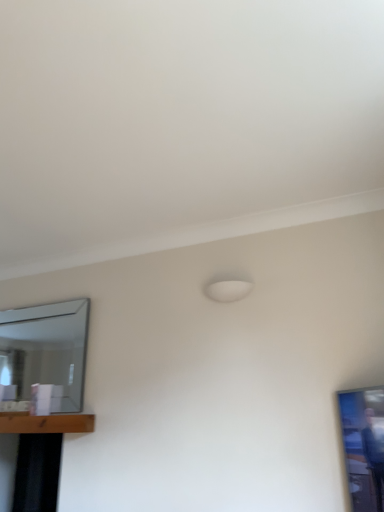
Question: Looking at the image, does brown wooden table at lower left, which appears as the first table when viewed from the top, seem bigger or smaller compared to clear glass mirror at left?

Choices:
 (A) big
 (B) small

Answer: (B)

Question: From the image's perspective, is brown wooden table at lower left, which appears as the first table when viewed from the top, positioned above or below clear glass mirror at left?

Choices:
 (A) below
 (B) above

Answer: (A)

Question: Which is farther from the clear glass mirror at left?

Choices:
 (A) brown wooden table at lower left, which is the second table from bottom to top
 (B) black matte table at lower left, the 1th table ordered from the bottom

Answer: (B)

Question: Based on their relative distances, which object is nearer to the clear glass mirror at left?

Choices:
 (A) brown wooden table at lower left, which is the second table from bottom to top
 (B) black matte table at lower left, the 1th table ordered from the bottom

Answer: (A)